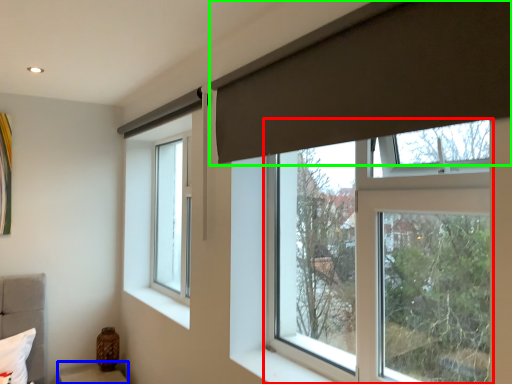
Question: Estimate the real-world distances between objects in this image. Which object is closer to window (highlighted by a red box), furniture (highlighted by a blue box) or curtain (highlighted by a green box)?

Choices:
 (A) furniture
 (B) curtain

Answer: (B)